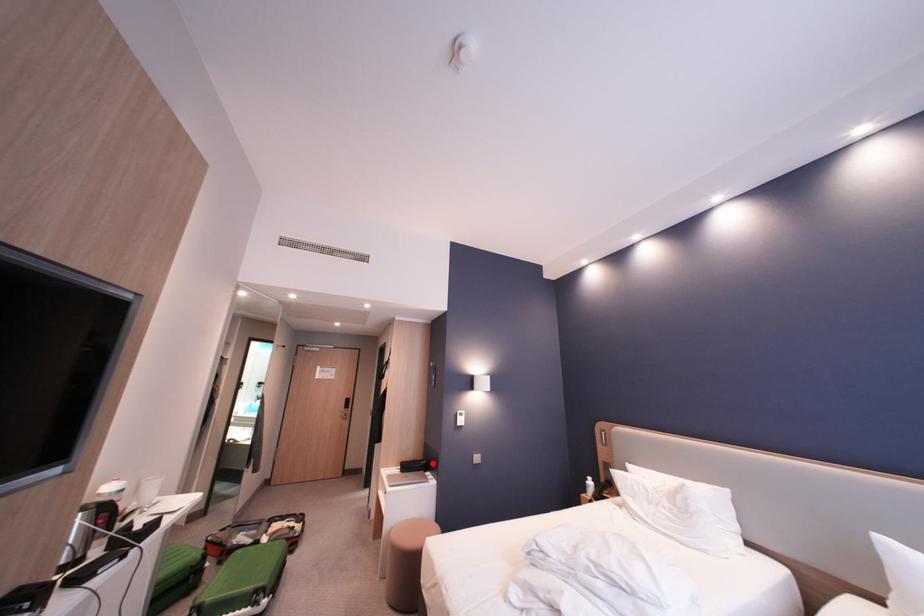
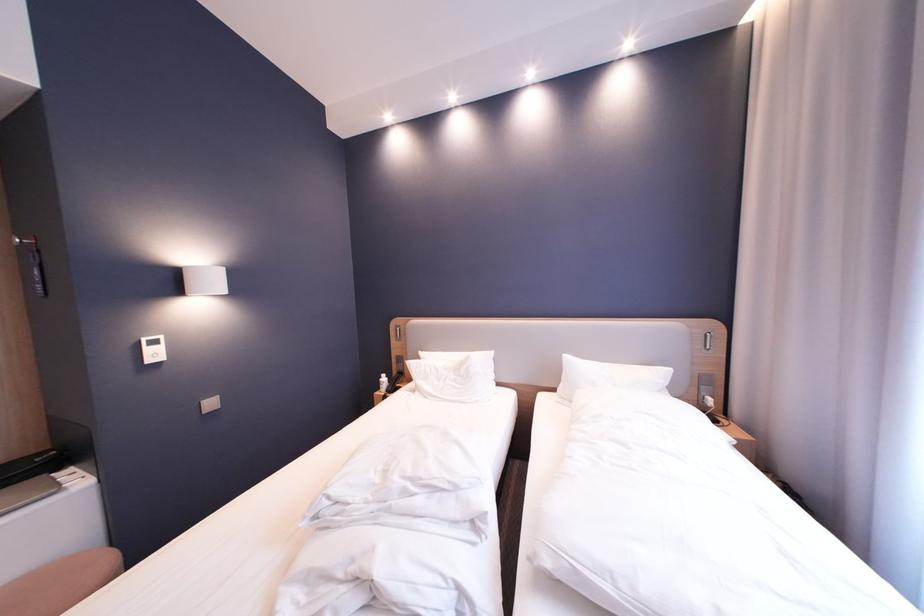
Question: I am providing you with two images of the same scene from different viewpoints. A red point is shown in image1. For the corresponding object point in image2, is it positioned nearer or farther from the camera?

Choices:
 (A) Nearer
 (B) Farther

Answer: (A)